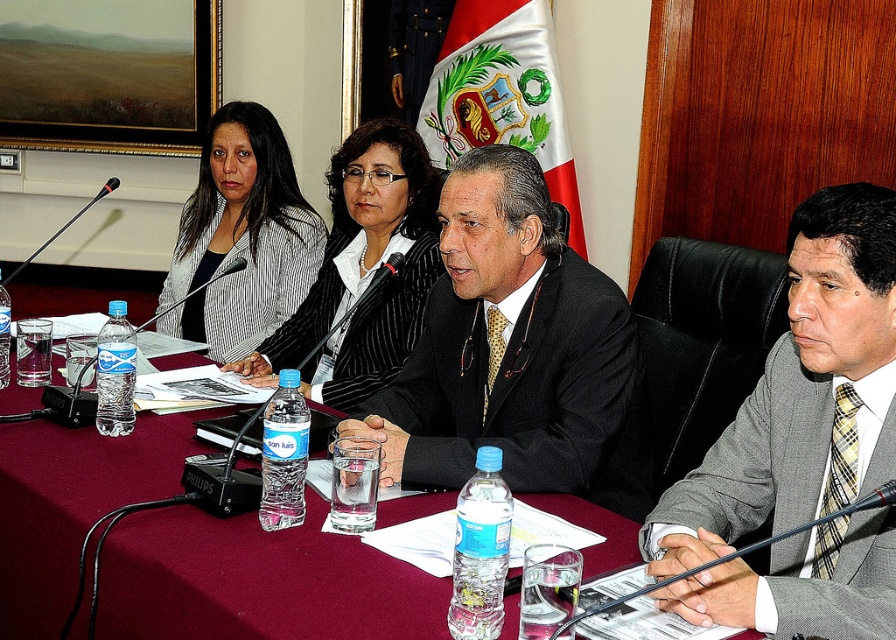
Does black satin suit at center lie behind matte black blazer at center?

No.

Who is taller, black satin suit at center or matte black blazer at center?

Standing taller between the two is matte black blazer at center.

Is point (595, 291) farther from viewer compared to point (401, 353)?

That is False.

The image size is (896, 640). What are the coordinates of `black satin suit at center` in the screenshot? It's located at (526, 392).

Is point (4, 397) positioned after point (823, 333)?

Yes, point (4, 397) is farther from viewer.

Is maroon fabric table at center to the right of gray textured suit at center from the viewer's perspective?

Incorrect, maroon fabric table at center is not on the right side of gray textured suit at center.

The height and width of the screenshot is (640, 896). What are the coordinates of `maroon fabric table at center` in the screenshot? It's located at (257, 580).

Is maroon fabric table at center thinner than matte black blazer at center?

In fact, maroon fabric table at center might be wider than matte black blazer at center.

Is point (108, 576) farther from camera compared to point (401, 225)?

No.

You are a GUI agent. You are given a task and a screenshot of the screen. Output one action in this format:
    pyautogui.click(x=<x>, y=<y>)
    Task: Click on the maroon fabric table at center
    
    Given the screenshot: What is the action you would take?
    pyautogui.click(x=257, y=580)